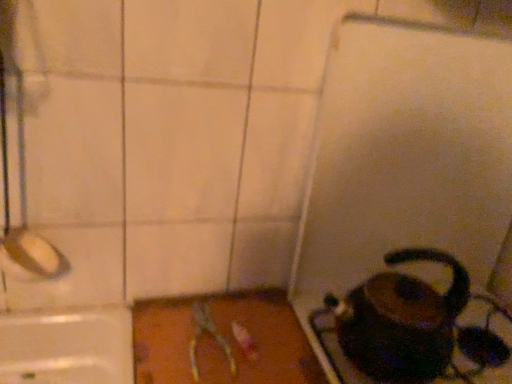
What do you see at coordinates (209, 333) in the screenshot?
I see `metallic silver scissors at center` at bounding box center [209, 333].

Locate an element on the screen. metallic silver scissors at center is located at coordinates (209, 333).

In order to face metallic silver scissors at center, should I rotate leftwards or rightwards?

Rotate your view left by about 6.477°.

The width and height of the screenshot is (512, 384). What do you see at coordinates (401, 321) in the screenshot? I see `shiny black kettle at lower right` at bounding box center [401, 321].

Measure the distance between point (462, 300) and camera.

They are 29.25 inches apart.

Where is `shiny black kettle at lower right`? This screenshot has width=512, height=384. shiny black kettle at lower right is located at coordinates (401, 321).

Locate an element on the screen. This screenshot has height=384, width=512. metallic silver scissors at center is located at coordinates (209, 333).

Considering the relative positions of shiny black kettle at lower right and metallic silver scissors at center in the image provided, is shiny black kettle at lower right to the right of metallic silver scissors at center from the viewer's perspective?

Yes.

Considering the positions of objects shiny black kettle at lower right and metallic silver scissors at center in the image provided, who is in front, shiny black kettle at lower right or metallic silver scissors at center?

shiny black kettle at lower right is closer to the camera.

Is point (367, 300) in front of point (195, 363)?

No, it is not.

From the image's perspective, between shiny black kettle at lower right and metallic silver scissors at center, who is located below?

metallic silver scissors at center is shown below in the image.

From a real-world perspective, is shiny black kettle at lower right physically located above or below metallic silver scissors at center?

shiny black kettle at lower right is situated higher than metallic silver scissors at center in the real world.

Is shiny black kettle at lower right thinner than metallic silver scissors at center?

Indeed, shiny black kettle at lower right has a lesser width compared to metallic silver scissors at center.

Does shiny black kettle at lower right have a lesser height compared to metallic silver scissors at center?

No, shiny black kettle at lower right is not shorter than metallic silver scissors at center.

Can you confirm if shiny black kettle at lower right is smaller than metallic silver scissors at center?

Actually, shiny black kettle at lower right might be larger than metallic silver scissors at center.

Would you say shiny black kettle at lower right contains metallic silver scissors at center?

No, metallic silver scissors at center is not inside shiny black kettle at lower right.

Is shiny black kettle at lower right not near metallic silver scissors at center?

shiny black kettle at lower right is near metallic silver scissors at center, not far away.

Is metallic silver scissors at center at the back of shiny black kettle at lower right?

shiny black kettle at lower right is not turned away from metallic silver scissors at center.

At what (x,y) coordinates should I click in order to perform the action: click on scissors located underneath the shiny black kettle at lower right (from a real-world perspective). Please return your answer as a coordinate pair (x, y). The width and height of the screenshot is (512, 384). Looking at the image, I should click on point(209,333).

Visually, is metallic silver scissors at center positioned to the left or to the right of shiny black kettle at lower right?

metallic silver scissors at center is to the left of shiny black kettle at lower right.

Does metallic silver scissors at center lie behind shiny black kettle at lower right?

Yes, the depth of metallic silver scissors at center is greater than that of shiny black kettle at lower right.

Which is in front, point (200, 319) or point (437, 295)?

The point (437, 295) is in front.

From the image's perspective, between metallic silver scissors at center and shiny black kettle at lower right, who is located below?

metallic silver scissors at center appears lower in the image.

From a real-world perspective, between metallic silver scissors at center and shiny black kettle at lower right, who is vertically lower?

metallic silver scissors at center.

Can you confirm if metallic silver scissors at center is wider than shiny black kettle at lower right?

Yes.

In terms of height, does metallic silver scissors at center look taller or shorter compared to shiny black kettle at lower right?

Considering their sizes, metallic silver scissors at center has less height than shiny black kettle at lower right.

Between metallic silver scissors at center and shiny black kettle at lower right, which one has larger size?

shiny black kettle at lower right.

Is metallic silver scissors at center positioned beyond the bounds of shiny black kettle at lower right?

metallic silver scissors at center is positioned outside shiny black kettle at lower right.

Are metallic silver scissors at center and shiny black kettle at lower right making contact?

No, metallic silver scissors at center is not in contact with shiny black kettle at lower right.

Does metallic silver scissors at center turn towards shiny black kettle at lower right?

No, metallic silver scissors at center is not facing towards shiny black kettle at lower right.

Where is `coffeepot that is on the right side of metallic silver scissors at center`? coffeepot that is on the right side of metallic silver scissors at center is located at coordinates (401, 321).

Find the location of a particular element. This screenshot has width=512, height=384. coffeepot above the metallic silver scissors at center (from the image's perspective) is located at coordinates (401, 321).

You are a GUI agent. You are given a task and a screenshot of the screen. Output one action in this format:
    pyautogui.click(x=<x>, y=<y>)
    Task: Click on the coffeepot in front of the metallic silver scissors at center
    
    Given the screenshot: What is the action you would take?
    pyautogui.click(x=401, y=321)